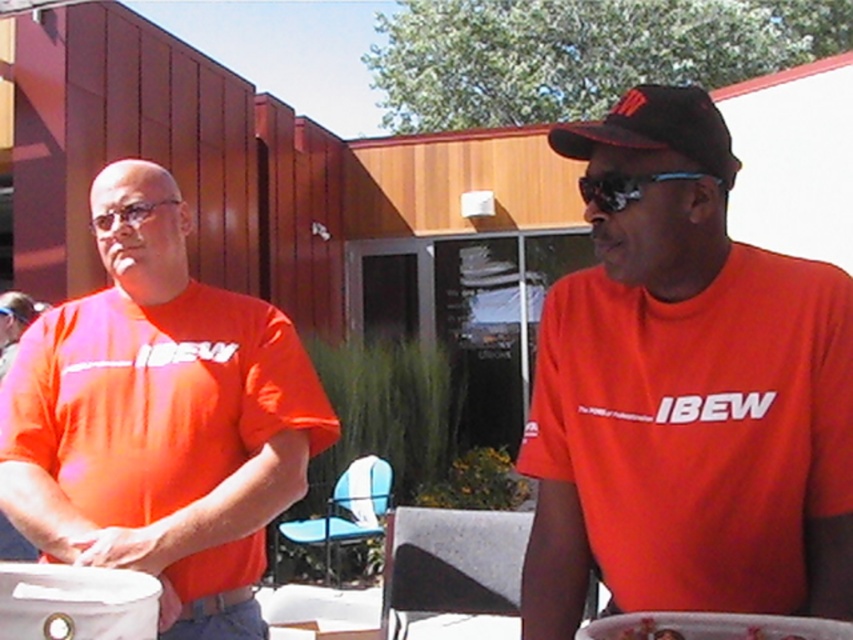
I want to click on orange matte t-shirt at left, so click(x=160, y=419).

Consider the image. Is orange matte t-shirt at left thinner than sunglasses at center?

Incorrect, orange matte t-shirt at left's width is not less than sunglasses at center's.

Is point (38, 372) in front of point (579, 184)?

No, it is behind (579, 184).

Identify the location of orange matte t-shirt at left. The image size is (853, 640). (160, 419).

Is orange matte t-shirt at center positioned in front of black fabric baseball cap at upper right?

Yes, it is.

Can you confirm if orange matte t-shirt at center is positioned to the left of black fabric baseball cap at upper right?

Correct, you'll find orange matte t-shirt at center to the left of black fabric baseball cap at upper right.

Is point (645, 332) closer to camera compared to point (654, 138)?

No, (645, 332) is further to viewer.

At what (x,y) coordinates should I click in order to perform the action: click on orange matte t-shirt at center. Please return your answer as a coordinate pair (x, y). Looking at the image, I should click on (686, 396).

Is orange matte t-shirt at center positioned at the back of matte white platter at center?

Yes, orange matte t-shirt at center is behind matte white platter at center.

Which is more to the left, orange matte t-shirt at center or matte white platter at center?

→ orange matte t-shirt at center is more to the left.

Between point (773, 456) and point (695, 636), which one is positioned behind?

Positioned behind is point (773, 456).

Where is `orange matte t-shirt at center`? orange matte t-shirt at center is located at coordinates (686, 396).